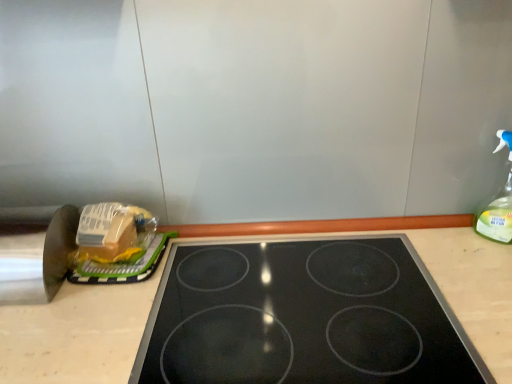
Question: Can you confirm if translucent plastic bag at left is smaller than clear plastic spray bottle at right?

Choices:
 (A) no
 (B) yes

Answer: (A)

Question: Considering the relative sizes of translucent plastic bag at left and clear plastic spray bottle at right in the image provided, is translucent plastic bag at left thinner than clear plastic spray bottle at right?

Choices:
 (A) no
 (B) yes

Answer: (A)

Question: From a real-world perspective, is translucent plastic bag at left located higher than clear plastic spray bottle at right?

Choices:
 (A) no
 (B) yes

Answer: (A)

Question: From the image's perspective, is translucent plastic bag at left located beneath clear plastic spray bottle at right?

Choices:
 (A) yes
 (B) no

Answer: (A)

Question: Is translucent plastic bag at left to the left of clear plastic spray bottle at right from the viewer's perspective?

Choices:
 (A) yes
 (B) no

Answer: (A)

Question: Is translucent plastic bag at left to the left or to the right of black glass gas stove at center in the image?

Choices:
 (A) left
 (B) right

Answer: (A)

Question: Considering the positions of translucent plastic bag at left and black glass gas stove at center in the image, is translucent plastic bag at left wider or thinner than black glass gas stove at center?

Choices:
 (A) thin
 (B) wide

Answer: (A)

Question: From the image's perspective, is translucent plastic bag at left located above or below black glass gas stove at center?

Choices:
 (A) below
 (B) above

Answer: (B)

Question: Is translucent plastic bag at left in front of or behind black glass gas stove at center in the image?

Choices:
 (A) front
 (B) behind

Answer: (B)

Question: Would you say translucent plastic bag at left is to the left or to the right of clear plastic spray bottle at right in the picture?

Choices:
 (A) right
 (B) left

Answer: (B)

Question: In terms of width, does translucent plastic bag at left look wider or thinner when compared to clear plastic spray bottle at right?

Choices:
 (A) thin
 (B) wide

Answer: (B)

Question: Which is correct: translucent plastic bag at left is inside clear plastic spray bottle at right, or outside of it?

Choices:
 (A) inside
 (B) outside

Answer: (B)

Question: Is translucent plastic bag at left in front of or behind clear plastic spray bottle at right in the image?

Choices:
 (A) front
 (B) behind

Answer: (B)

Question: Would you say clear plastic spray bottle at right is to the left or to the right of translucent plastic bag at left in the picture?

Choices:
 (A) left
 (B) right

Answer: (B)

Question: Choose the correct answer: Is clear plastic spray bottle at right inside translucent plastic bag at left or outside it?

Choices:
 (A) outside
 (B) inside

Answer: (A)